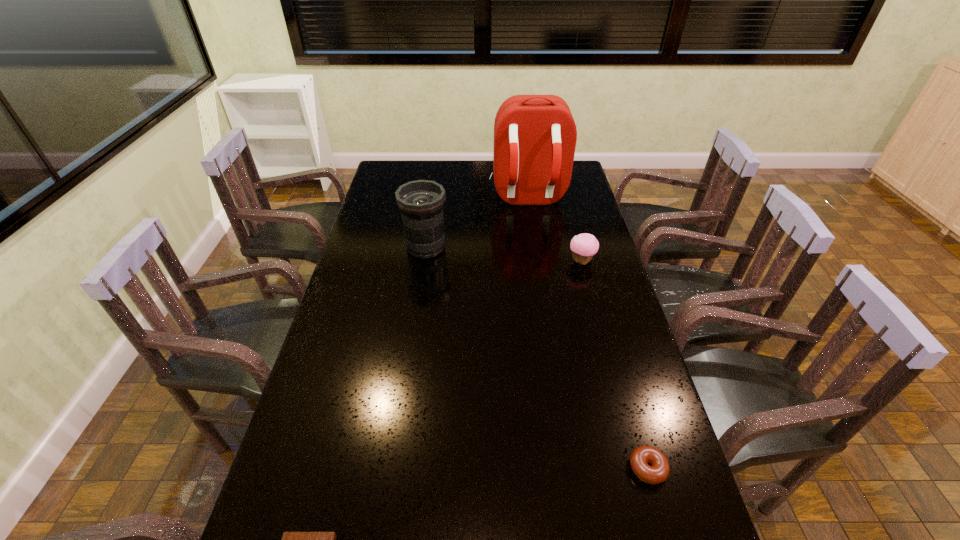
Identify the location of empty space between the farthest object and the fourth shortest object. The image size is (960, 540). (476, 223).

In order to click on free spot between the doughnut and the second tallest object in this screenshot , I will do `click(537, 358)`.

The width and height of the screenshot is (960, 540). I want to click on vacant space that is in between the tallest object and the telephoto lens, so click(476, 223).

The width and height of the screenshot is (960, 540). In order to click on vacant area that lies between the backpack and the third tallest object in this screenshot , I will do `click(555, 230)`.

The height and width of the screenshot is (540, 960). I want to click on vacant space in between the backpack and the telephoto lens, so [x=476, y=223].

Locate which object is the third closest to the tallest object. Please provide its 2D coordinates. Your answer should be formatted as a tuple, i.e. [(x, y)], where the tuple contains the x and y coordinates of a point satisfying the conditions above.

[(659, 471)]

Identify which object is located as the third nearest to the cupcake. Please provide its 2D coordinates. Your answer should be formatted as a tuple, i.e. [(x, y)], where the tuple contains the x and y coordinates of a point satisfying the conditions above.

[(659, 471)]

I want to click on free spot that satisfies the following two spatial constraints: 1. on the strap side of the cupcake; 2. on the right side of the tallest object, so click(537, 261).

Locate an element on the screen. This screenshot has height=540, width=960. free space that satisfies the following two spatial constraints: 1. on the strap side of the farthest object; 2. on the left side of the cupcake is located at coordinates (537, 261).